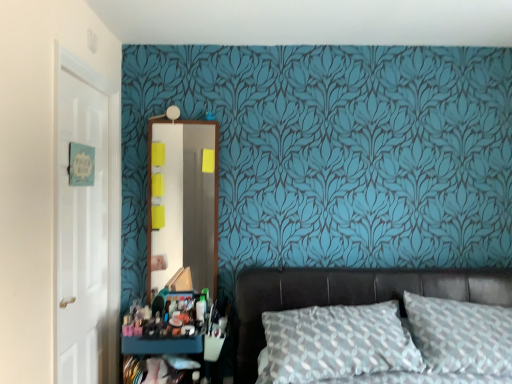
Question: From the image's perspective, is leather bed at lower right on top of textured gray pillow at center?

Choices:
 (A) yes
 (B) no

Answer: (B)

Question: Is textured gray pillow at center a part of leather bed at lower right?

Choices:
 (A) no
 (B) yes

Answer: (A)

Question: Is leather bed at lower right not inside textured gray pillow at center?

Choices:
 (A) no
 (B) yes

Answer: (B)

Question: From a real-world perspective, is leather bed at lower right on top of textured gray pillow at center?

Choices:
 (A) yes
 (B) no

Answer: (B)

Question: Does leather bed at lower right have a greater height compared to textured gray pillow at center?

Choices:
 (A) no
 (B) yes

Answer: (A)

Question: Is leather bed at lower right smaller than textured gray pillow at center?

Choices:
 (A) no
 (B) yes

Answer: (A)

Question: Is wooden mirror at center positioned far away from white glossy door at left?

Choices:
 (A) yes
 (B) no

Answer: (B)

Question: Does wooden mirror at center have a lesser width compared to white glossy door at left?

Choices:
 (A) yes
 (B) no

Answer: (A)

Question: Can we say wooden mirror at center lies outside white glossy door at left?

Choices:
 (A) yes
 (B) no

Answer: (A)

Question: Does wooden mirror at center turn towards white glossy door at left?

Choices:
 (A) no
 (B) yes

Answer: (A)

Question: From a real-world perspective, is wooden mirror at center beneath white glossy door at left?

Choices:
 (A) yes
 (B) no

Answer: (B)

Question: Can you confirm if wooden mirror at center is positioned to the right of white glossy door at left?

Choices:
 (A) yes
 (B) no

Answer: (A)

Question: Is white glossy door at left facing away from leather bed at lower right?

Choices:
 (A) no
 (B) yes

Answer: (A)